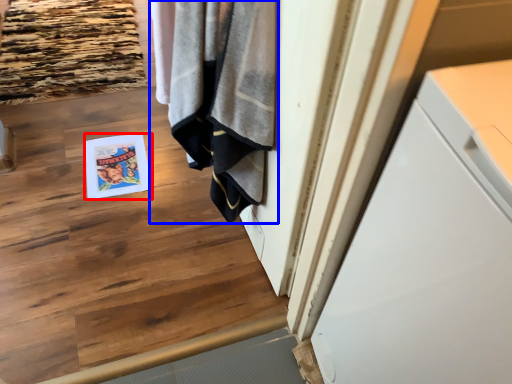
Question: Among these objects, which one is nearest to the camera, magazine (highlighted by a red box) or bath towel (highlighted by a blue box)?

Choices:
 (A) magazine
 (B) bath towel

Answer: (B)